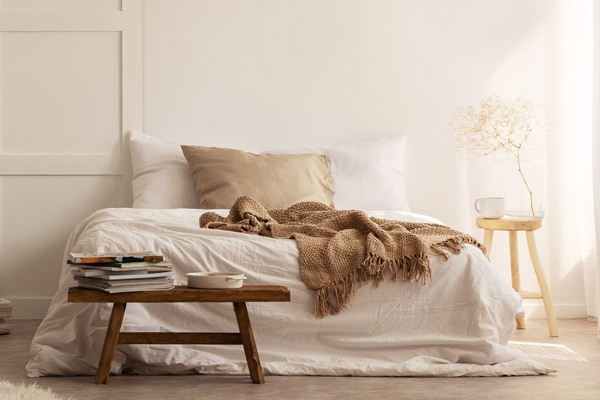
What are the coordinates of `floor` in the screenshot? It's located at (581, 352).